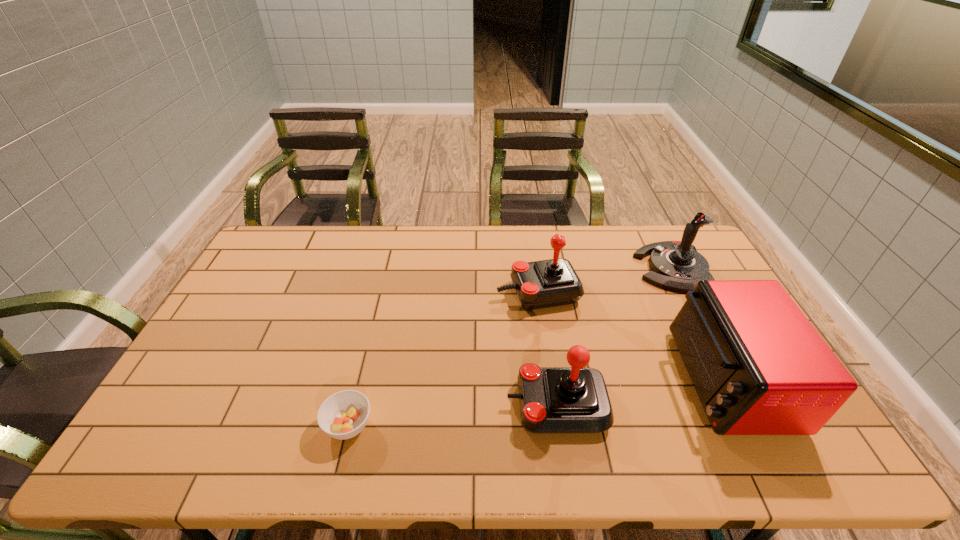
What are the coordinates of `vacant area situated 0.310m on the base of the nearest joystick` in the screenshot? It's located at (386, 404).

This screenshot has height=540, width=960. Find the location of `free spot located on the front-facing side of the toaster oven`. free spot located on the front-facing side of the toaster oven is located at coordinates (554, 380).

The width and height of the screenshot is (960, 540). What are the coordinates of `vacant space situated on the front-facing side of the toaster oven` in the screenshot? It's located at (580, 380).

The image size is (960, 540). In order to click on vacant space situated on the front-facing side of the toaster oven in this screenshot , I will do `click(539, 380)`.

At what (x,y) coordinates should I click in order to perform the action: click on vacant region located on the left of the leftmost object. Please return your answer as a coordinate pair (x, y). Looking at the image, I should click on (181, 426).

At what (x,y) coordinates should I click in order to perform the action: click on object located in the far edge section of the desktop. Please return your answer as a coordinate pair (x, y). The image size is (960, 540). Looking at the image, I should click on (676, 265).

The width and height of the screenshot is (960, 540). In order to click on joystick present at the near edge in this screenshot , I will do `click(575, 399)`.

Locate an element on the screen. This screenshot has width=960, height=540. toaster oven present at the near edge is located at coordinates (759, 367).

Identify the location of soup bowl located at the near edge. (343, 415).

You are a GUI agent. You are given a task and a screenshot of the screen. Output one action in this format:
    pyautogui.click(x=<x>, y=<y>)
    Task: Click on the joystick located in the right edge section of the desktop
    This screenshot has height=540, width=960.
    Given the screenshot: What is the action you would take?
    pyautogui.click(x=676, y=265)